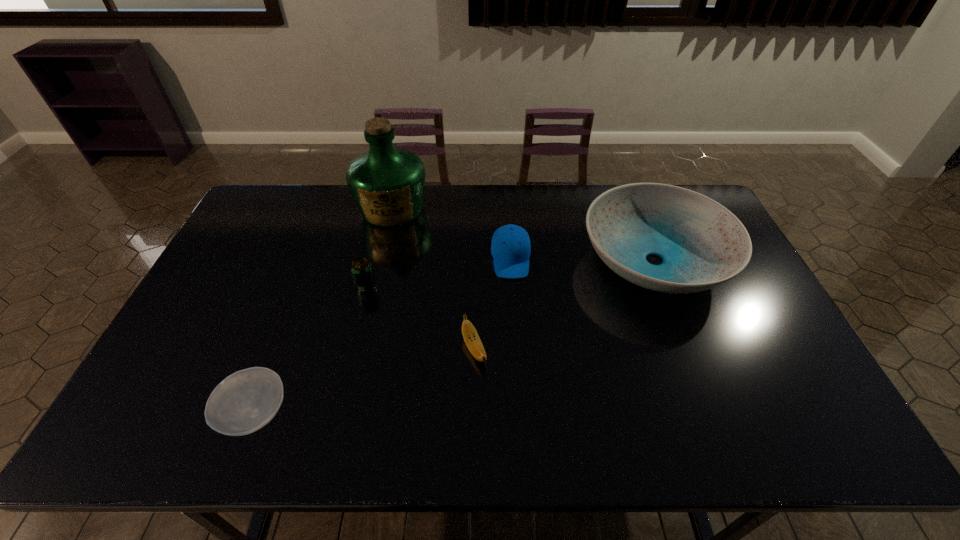
This screenshot has width=960, height=540. What are the coordinates of `empty space that is in between the nearest object and the beer can` in the screenshot? It's located at click(311, 350).

Where is `free space between the rightmost object and the bowl`? This screenshot has width=960, height=540. free space between the rightmost object and the bowl is located at coordinates (455, 337).

Identify which object is the fifth nearest to the fourth object from left to right. Please provide its 2D coordinates. Your answer should be formatted as a tuple, i.e. [(x, y)], where the tuple contains the x and y coordinates of a point satisfying the conditions above.

[(387, 183)]

At what (x,y) coordinates should I click in order to perform the action: click on object identified as the fourth closest to the rightmost object. Please return your answer as a coordinate pair (x, y). Looking at the image, I should click on pyautogui.click(x=361, y=268).